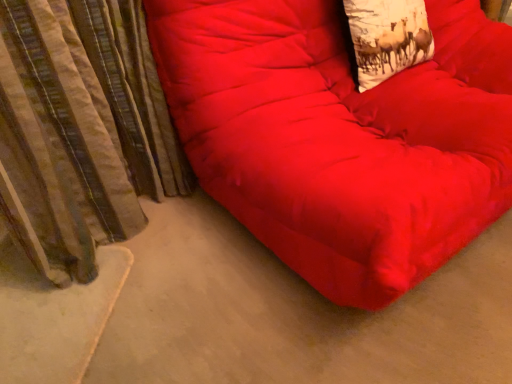
Locate an element on the screen. This screenshot has width=512, height=384. free space in front of striped fabric curtain at left is located at coordinates (75, 333).